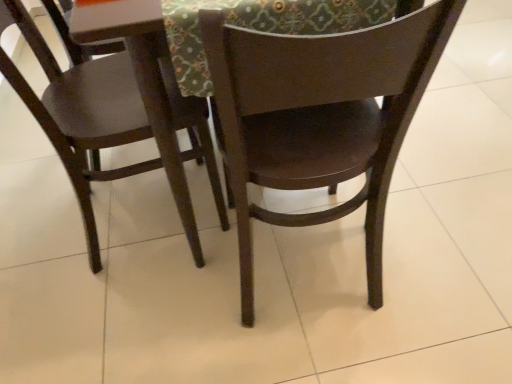
Identify the location of vacant area that is situated to the right of matte brown table at center. Image resolution: width=512 pixels, height=384 pixels. pyautogui.click(x=460, y=148).